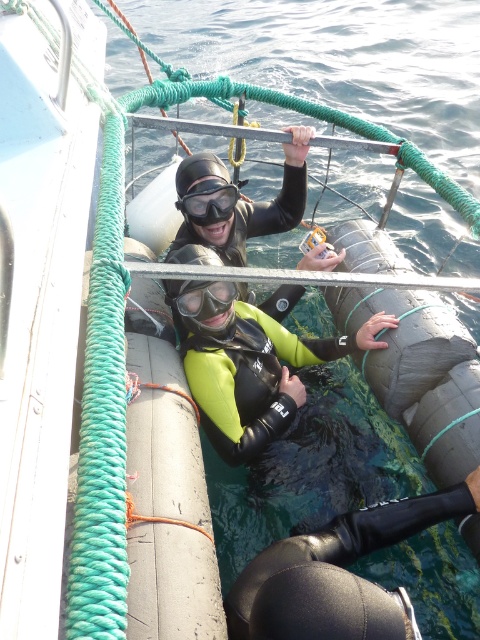
Question: Which object is farther from the camera taking this photo?

Choices:
 (A) neon green neoprene wetsuit at center
 (B) matte black goggles at center

Answer: (B)

Question: Can you confirm if neon green neoprene wetsuit at center is wider than matte black goggles at center?

Choices:
 (A) yes
 (B) no

Answer: (A)

Question: Is neon green neoprene wetsuit at center bigger than black matte goggles at center?

Choices:
 (A) yes
 (B) no

Answer: (A)

Question: Considering the real-world distances, which object is closest to the black matte goggles at center?

Choices:
 (A) neon green neoprene wetsuit at center
 (B) matte black goggles at center

Answer: (A)

Question: Among these points, which one is farthest from the camera?

Choices:
 (A) (284, 410)
 (B) (219, 180)
 (C) (203, 307)

Answer: (B)

Question: Is neon green neoprene wetsuit at center to the right of black matte goggles at center from the viewer's perspective?

Choices:
 (A) no
 (B) yes

Answer: (B)